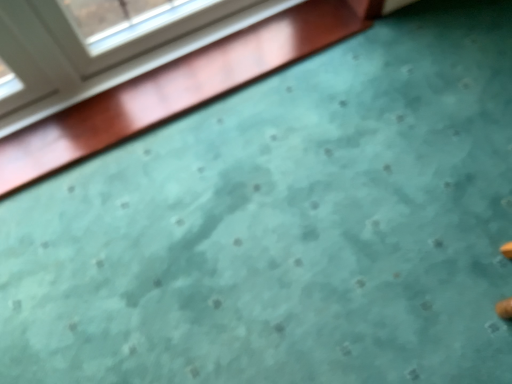
Identify the location of white plastic window at upper left. (142, 65).

What do you see at coordinates (142, 65) in the screenshot?
I see `white plastic window at upper left` at bounding box center [142, 65].

This screenshot has width=512, height=384. What are the coordinates of `white plastic window at upper left` in the screenshot? It's located at (142, 65).